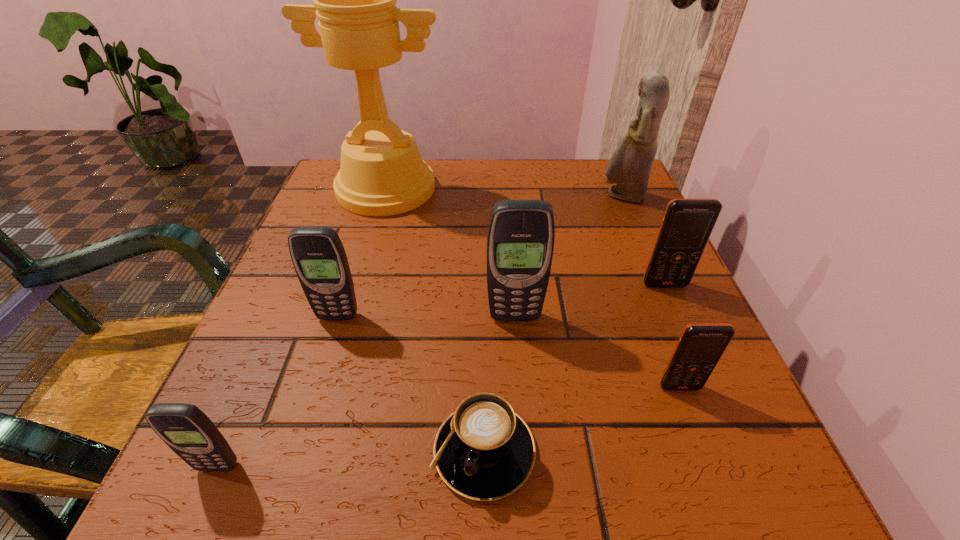
Locate an element on the screen. The height and width of the screenshot is (540, 960). award is located at coordinates (382, 173).

At what (x,y) coordinates should I click in order to perform the action: click on beige award. Please return your answer as a coordinate pair (x, y). The image size is (960, 540). Looking at the image, I should click on (382, 173).

Where is `the second tallest object`? The width and height of the screenshot is (960, 540). the second tallest object is located at coordinates (630, 165).

Identify the location of the tallest cellular telephone. (520, 240).

Where is `the third cellular telephone from right to left`? This screenshot has height=540, width=960. the third cellular telephone from right to left is located at coordinates (520, 240).

Where is `the second gray cellular telephone from left to right`? This screenshot has height=540, width=960. the second gray cellular telephone from left to right is located at coordinates tap(319, 258).

Where is `the second smallest gray cellular telephone`? the second smallest gray cellular telephone is located at coordinates (319, 258).

Locate an element on the screen. The image size is (960, 540). the farthest cellular telephone is located at coordinates (687, 224).

Identify the location of the farther orange cellular telephone. (687, 224).

At what (x,y) coordinates should I click in order to perform the action: click on the nearer orange cellular telephone. Please return your answer as a coordinate pair (x, y). The width and height of the screenshot is (960, 540). Looking at the image, I should click on (701, 345).